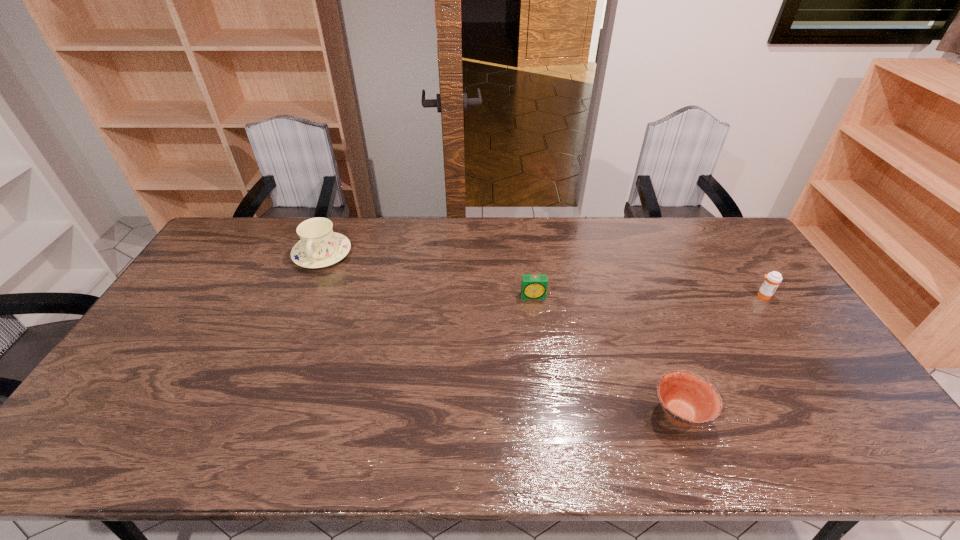
Locate an element on the screen. object situated at the far edge is located at coordinates (319, 246).

Find the location of a particular element. object that is at the near edge is located at coordinates (687, 399).

Where is `object positioned at the right edge`? object positioned at the right edge is located at coordinates (773, 279).

This screenshot has width=960, height=540. In the image, there is a desktop. Find the location of `free space at the far edge`. free space at the far edge is located at coordinates (695, 256).

This screenshot has width=960, height=540. I want to click on free space at the left edge of the desktop, so click(221, 280).

What are the coordinates of `free location at the far right corner of the desktop` in the screenshot? It's located at (706, 244).

You are a GUI agent. You are given a task and a screenshot of the screen. Output one action in this format:
    pyautogui.click(x=<x>, y=<y>)
    Task: Click on the free spot between the farthest object and the alarm clock
    This screenshot has height=540, width=960.
    Given the screenshot: What is the action you would take?
    pyautogui.click(x=428, y=275)

The image size is (960, 540). I want to click on vacant region between the farthest object and the bowl, so click(x=501, y=333).

Find the location of a particular element. empty space that is in between the tallest object and the second object from right to left is located at coordinates (501, 333).

You are a GUI agent. You are given a task and a screenshot of the screen. Output one action in this format:
    pyautogui.click(x=<x>, y=<y>)
    Task: Click on the free area in between the bowl and the second object from left to right
    This screenshot has width=960, height=540.
    Given the screenshot: What is the action you would take?
    pyautogui.click(x=607, y=355)